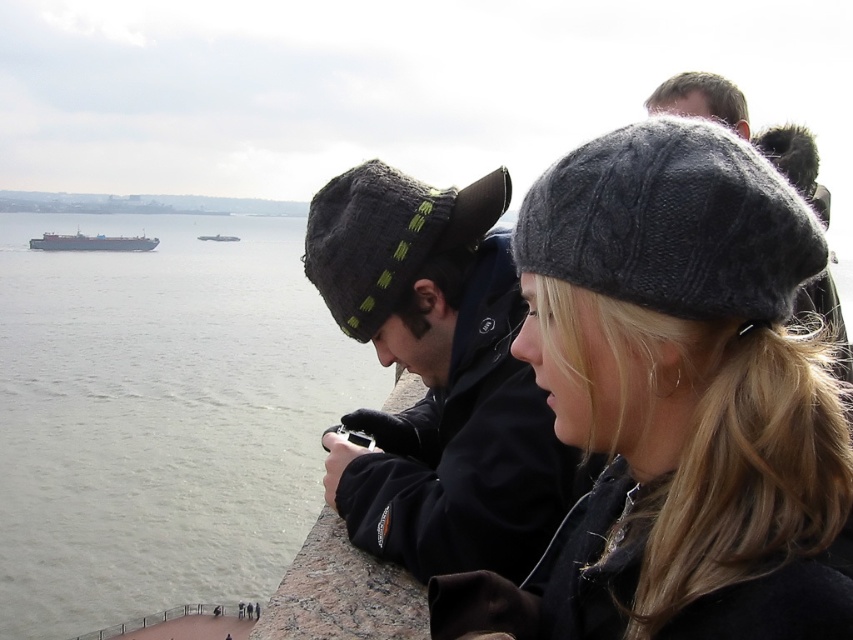
Question: Does knitted gray hat at center have a smaller size compared to metallic gray ship at center-left?

Choices:
 (A) no
 (B) yes

Answer: (B)

Question: Which object is positioned closest to the knitted gray hat at center?

Choices:
 (A) metallic gray ship at left
 (B) dark gray knit hat at center
 (C) metallic gray ship at center-left

Answer: (B)

Question: Is metallic gray ship at center-left below metallic gray ship at left?

Choices:
 (A) no
 (B) yes

Answer: (B)

Question: Which point is farther from the camera taking this photo?

Choices:
 (A) (262, 294)
 (B) (489, 262)
 (C) (146, 250)
 (D) (238, 237)

Answer: (D)

Question: Can you confirm if gray matte water at center is positioned to the right of metallic gray ship at left?

Choices:
 (A) no
 (B) yes

Answer: (B)

Question: Based on their relative distances, which object is farther from the dark gray knit hat at center?

Choices:
 (A) metallic gray ship at left
 (B) metallic gray ship at center-left

Answer: (B)